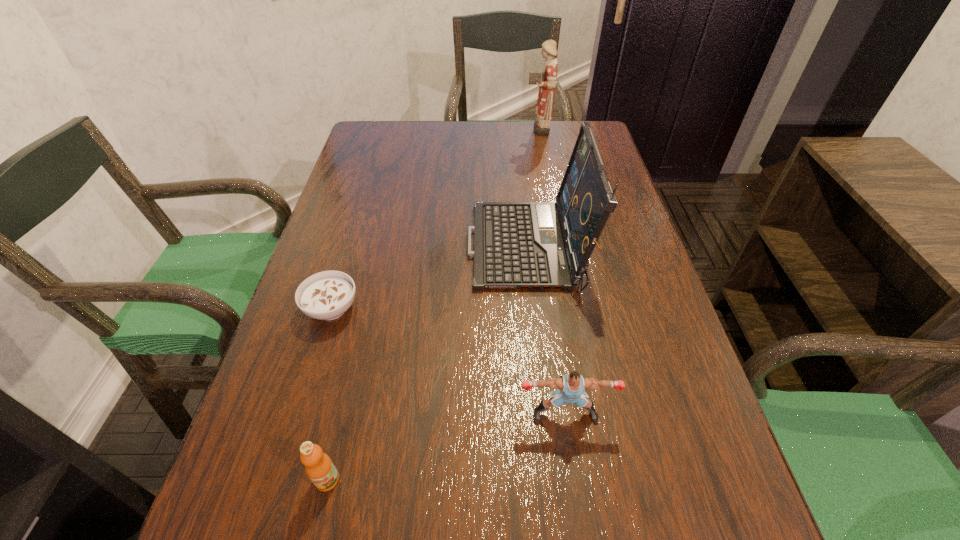
I want to click on vacant position located on the front-facing side of the laptop computer, so click(341, 248).

Where is `blank area located 0.170m on the front-facing side of the second nearest object`? The image size is (960, 540). blank area located 0.170m on the front-facing side of the second nearest object is located at coordinates (583, 539).

Image resolution: width=960 pixels, height=540 pixels. What are the coordinates of `free space located on the front label of the orange juice` in the screenshot? It's located at [316, 529].

You are a GUI agent. You are given a task and a screenshot of the screen. Output one action in this format:
    pyautogui.click(x=<x>, y=<y>)
    Task: Click on the vacant region located 0.310m on the back of the soup bowl
    
    Given the screenshot: What is the action you would take?
    pyautogui.click(x=364, y=201)

At what (x,y) coordinates should I click in order to perform the action: click on object situated at the far edge. Please return your answer as a coordinate pair (x, y). The image size is (960, 540). Looking at the image, I should click on (546, 80).

At what (x,y) coordinates should I click in order to perform the action: click on orange juice at the left edge. Please return your answer as a coordinate pair (x, y). The image size is (960, 540). Looking at the image, I should click on (320, 469).

Locate an element on the screen. The image size is (960, 540). soup bowl present at the left edge is located at coordinates (327, 295).

Identify the location of figurine that is at the right edge. The height and width of the screenshot is (540, 960). (546, 80).

Identify the location of laptop computer that is at the right edge. This screenshot has height=540, width=960. (517, 245).

I want to click on puncher that is at the right edge, so click(571, 387).